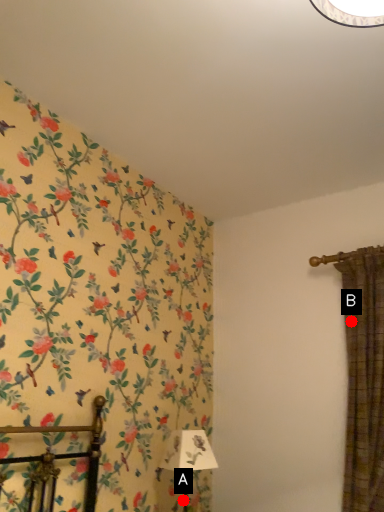
Question: Two points are circled on the image, labeled by A and B beside each circle. Which point is farther to the camera?

Choices:
 (A) A is further
 (B) B is further

Answer: (B)